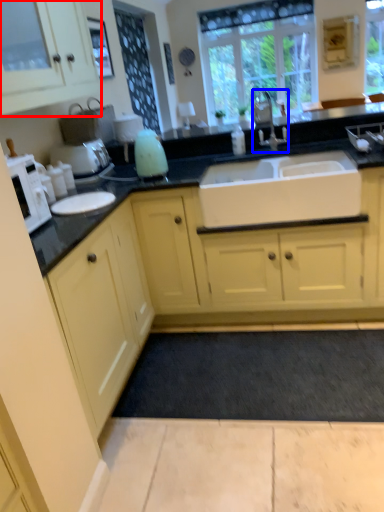
Question: Among these objects, which one is farthest to the camera, cabinetry (highlighted by a red box) or tap (highlighted by a blue box)?

Choices:
 (A) cabinetry
 (B) tap

Answer: (B)